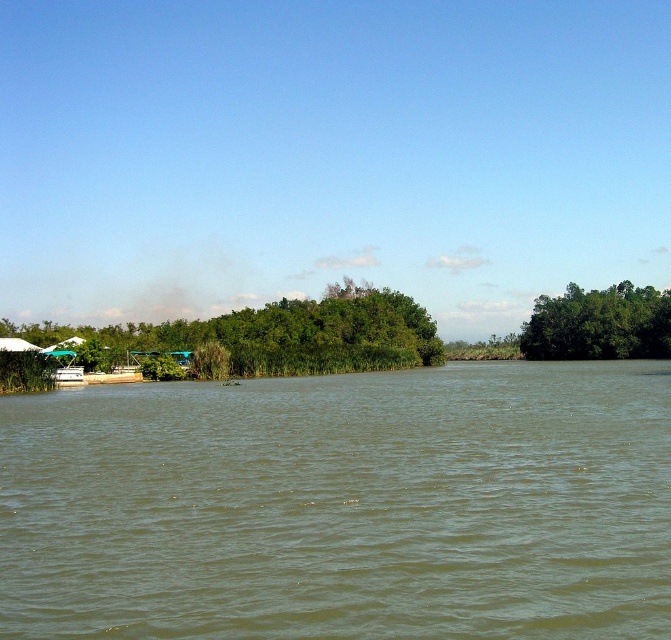
Is point (361, 326) positioned after point (666, 353)?

No.

Who is more distant from viewer, (293, 339) or (635, 291)?

The point (635, 291) is behind.

Identify the location of green leafy trees at center. Image resolution: width=671 pixels, height=640 pixels. (274, 336).

At what (x,y) coordinates should I click in order to perform the action: click on green leafy trees at center. Please return your answer as a coordinate pair (x, y). Image resolution: width=671 pixels, height=640 pixels. Looking at the image, I should click on (274, 336).

Is greenish-brown water at center thinner than green leafy trees at right?

No.

I want to click on greenish-brown water at center, so click(x=342, y=506).

Measure the distance between point (x=639, y=506) and camera.

Point (x=639, y=506) is 16.94 meters away from camera.

The width and height of the screenshot is (671, 640). In order to click on greenish-brown water at center in this screenshot , I will do `click(342, 506)`.

Who is more distant from viewer, (592, 586) or (366, 308)?

Positioned behind is point (366, 308).

Locate an element on the screen. The width and height of the screenshot is (671, 640). greenish-brown water at center is located at coordinates (342, 506).

Locate an element on the screen. The width and height of the screenshot is (671, 640). greenish-brown water at center is located at coordinates (342, 506).